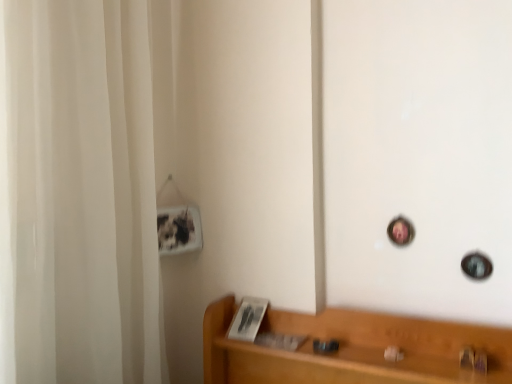
Where is `vacant point above light brown wood shelf at lower right (from a real-world perspective)`? The width and height of the screenshot is (512, 384). vacant point above light brown wood shelf at lower right (from a real-world perspective) is located at coordinates (382, 355).